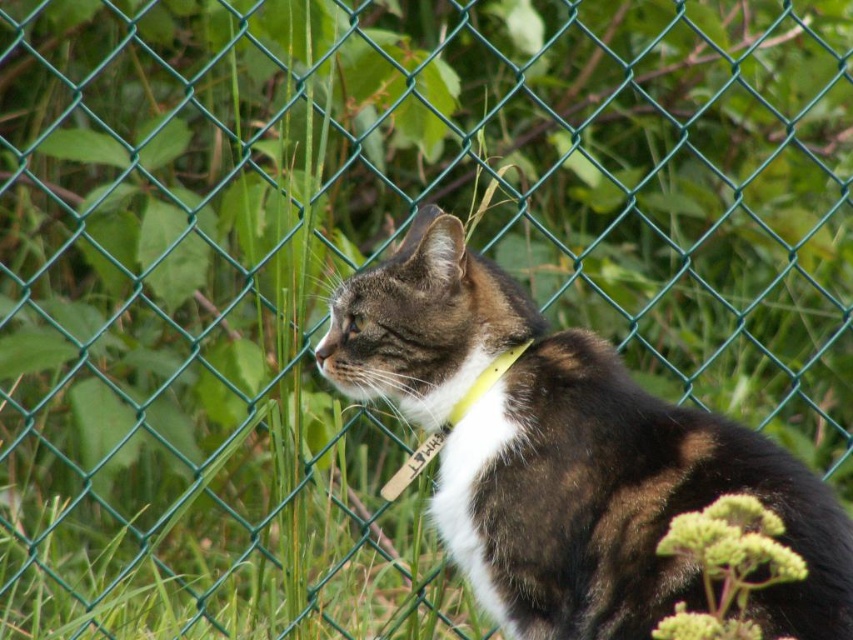
You are a photographer taking a picture of the tabby fur cat at center and the green fuzzy plant at lower right. Which object is positioned higher in the frame?

The tabby fur cat at center is positioned higher than the green fuzzy plant at lower right in the frame.

In the scene shown: You are a photographer trying to capture a clear shot of the tabby fur cat at center and the green fuzzy plant at lower right. Given that the cat is taller than the plant, which object should you focus on to ensure the subject with the greater height is in focus?

The tabby fur cat at center is taller than the green fuzzy plant at lower right, so you should focus on the tabby fur cat at center to ensure the taller subject is in focus.